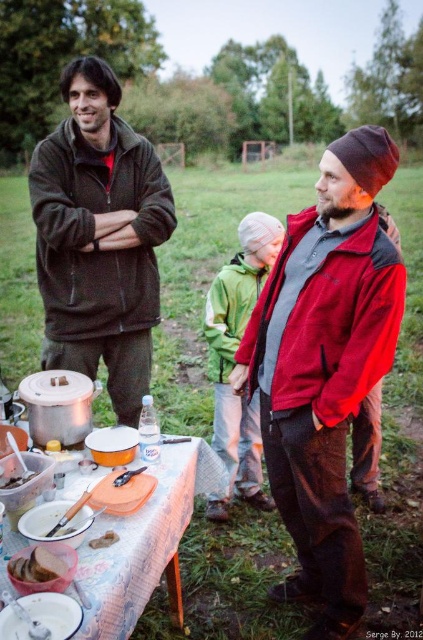
Can you confirm if orange plastic tray at center is shorter than white matte plate at lower left?

Incorrect, orange plastic tray at center's height does not fall short of white matte plate at lower left's.

Which of these two, orange plastic tray at center or white matte plate at lower left, stands taller?

orange plastic tray at center

The height and width of the screenshot is (640, 423). What do you see at coordinates (142, 541) in the screenshot?
I see `orange plastic tray at center` at bounding box center [142, 541].

Image resolution: width=423 pixels, height=640 pixels. I want to click on orange plastic tray at center, so click(x=142, y=541).

Can you confirm if red fleece jacket at center is smaller than brown matte clay pot at center?

→ No.

Does red fleece jacket at center appear under brown matte clay pot at center?

Incorrect, red fleece jacket at center is not positioned below brown matte clay pot at center.

The height and width of the screenshot is (640, 423). In order to click on red fleece jacket at center in this screenshot , I will do tap(324, 365).

At what (x,y) coordinates should I click in order to perform the action: click on red fleece jacket at center. Please return your answer as a coordinate pair (x, y). The width and height of the screenshot is (423, 640). Looking at the image, I should click on (324, 365).

Is orange plastic tray at center positioned behind smooth brown bread at center?

No, orange plastic tray at center is closer to the viewer.

Which is more to the left, orange plastic tray at center or smooth brown bread at center?

From the viewer's perspective, smooth brown bread at center appears more on the left side.

Between point (90, 614) and point (49, 563), which one is positioned behind?

Point (49, 563)

Locate an element on the screen. The width and height of the screenshot is (423, 640). orange plastic tray at center is located at coordinates (142, 541).